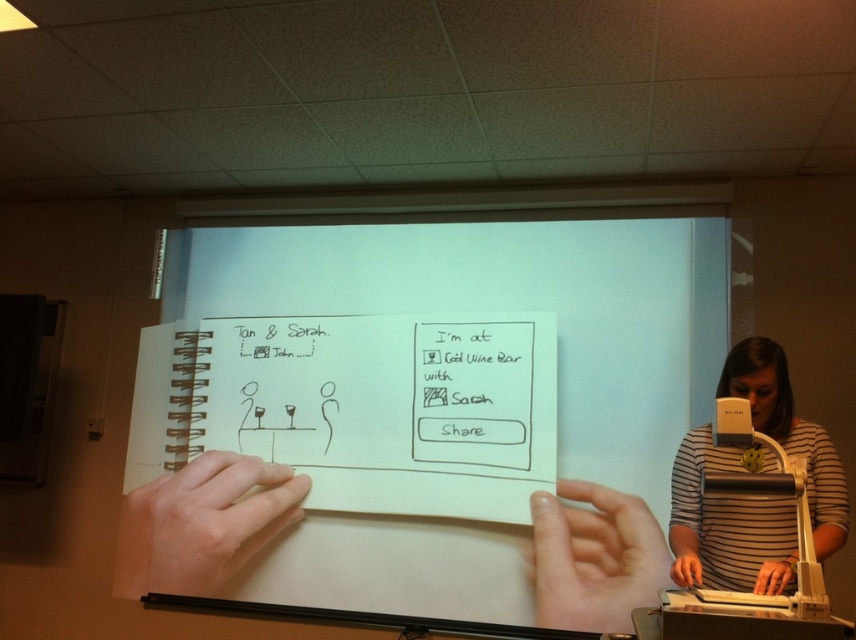
Question: Which point is closer to the camera?

Choices:
 (A) (759, 595)
 (B) (795, 557)

Answer: (A)

Question: Which point is farther to the camera?

Choices:
 (A) (580, 625)
 (B) (699, 589)
 (C) (239, 460)

Answer: (C)

Question: Which object appears closest to the camera in this image?

Choices:
 (A) pale skin at center
 (B) white paper notebook at center

Answer: (B)

Question: Is white paper notebook at center to the right of smooth skin hand at lower center from the viewer's perspective?

Choices:
 (A) no
 (B) yes

Answer: (A)

Question: Does striped cotton shirt at lower right appear on the right side of white paper notepad at lower right?

Choices:
 (A) yes
 (B) no

Answer: (A)

Question: Does white paper notebook at center have a greater width compared to smooth skin hand at lower right?

Choices:
 (A) yes
 (B) no

Answer: (A)